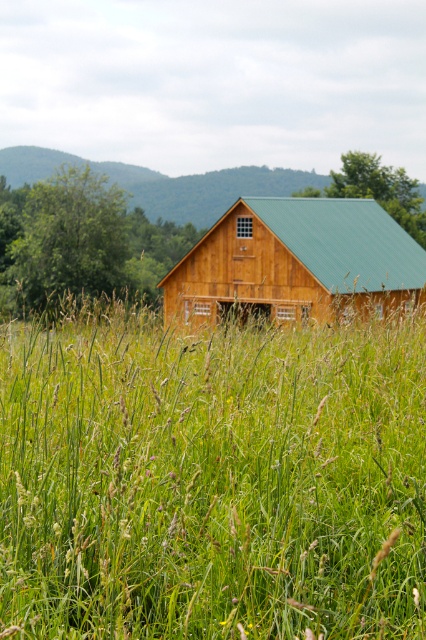
Does green grass at center have a greater width compared to wooden barn at center?

Incorrect, green grass at center's width does not surpass wooden barn at center's.

Is point (155, 563) positioned after point (374, 237)?

No, (155, 563) is in front of (374, 237).

This screenshot has height=640, width=426. I want to click on green grass at center, so click(x=210, y=477).